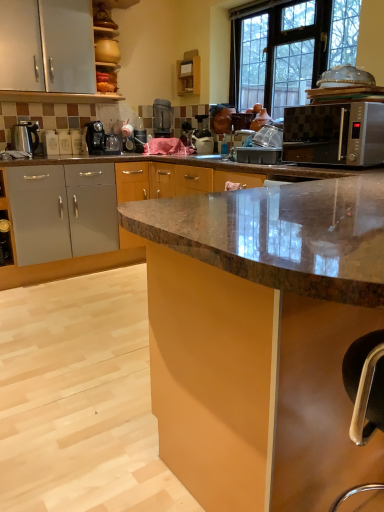
Question: Can you confirm if matte brown cabinet at center, the second cabinetry in the top-to-bottom sequence, is taller than wooden shelf at upper center, positioned as the 2th cabinetry in bottom-to-top order?

Choices:
 (A) no
 (B) yes

Answer: (B)

Question: Considering the relative sizes of matte brown cabinet at center, the 2th cabinetry from the back, and wooden shelf at upper center, the first cabinetry viewed from the back, in the image provided, is matte brown cabinet at center, the 2th cabinetry from the back, smaller than wooden shelf at upper center, the first cabinetry viewed from the back,?

Choices:
 (A) yes
 (B) no

Answer: (B)

Question: Is matte brown cabinet at center, the second cabinetry in the top-to-bottom sequence, outside of wooden shelf at upper center, the first cabinetry viewed from the back?

Choices:
 (A) no
 (B) yes

Answer: (B)

Question: Considering the relative sizes of matte brown cabinet at center, the 2th cabinetry from the back, and wooden shelf at upper center, positioned as the 2th cabinetry in bottom-to-top order, in the image provided, is matte brown cabinet at center, the 2th cabinetry from the back, wider than wooden shelf at upper center, positioned as the 2th cabinetry in bottom-to-top order,?

Choices:
 (A) yes
 (B) no

Answer: (A)

Question: Is matte brown cabinet at center, the 2th cabinetry from the back, shorter than wooden shelf at upper center, positioned as the 2th cabinetry in bottom-to-top order?

Choices:
 (A) no
 (B) yes

Answer: (A)

Question: Considering the relative positions of satin silver microwave at right and matte brown cabinet at center, the second cabinetry in the top-to-bottom sequence, in the image provided, is satin silver microwave at right to the left or to the right of matte brown cabinet at center, the second cabinetry in the top-to-bottom sequence,?

Choices:
 (A) right
 (B) left

Answer: (A)

Question: Considering the positions of satin silver microwave at right and matte brown cabinet at center, which is counted as the second cabinetry, starting from the left, in the image, is satin silver microwave at right taller or shorter than matte brown cabinet at center, which is counted as the second cabinetry, starting from the left,?

Choices:
 (A) tall
 (B) short

Answer: (B)

Question: In terms of width, does satin silver microwave at right look wider or thinner when compared to matte brown cabinet at center, which ranks as the 1th cabinetry in right-to-left order?

Choices:
 (A) thin
 (B) wide

Answer: (A)

Question: Is point (334, 141) closer or farther from the camera than point (147, 287)?

Choices:
 (A) farther
 (B) closer

Answer: (A)

Question: From the image's perspective, is matte brown cabinet at center, which is counted as the second cabinetry, starting from the left, positioned above or below satin black coffee machine at center, positioned as the first coffee machine in back-to-front order?

Choices:
 (A) below
 (B) above

Answer: (A)

Question: Is matte brown cabinet at center, which is the first cabinetry from bottom to top, bigger or smaller than satin black coffee machine at center, which ranks as the 2th coffee machine in front-to-back order?

Choices:
 (A) small
 (B) big

Answer: (B)

Question: From a real-world perspective, is matte brown cabinet at center, which ranks as the 1th cabinetry in right-to-left order, physically located above or below satin black coffee machine at center, positioned as the first coffee machine in back-to-front order?

Choices:
 (A) below
 (B) above

Answer: (A)

Question: Looking at their shapes, would you say matte brown cabinet at center, the second cabinetry in the top-to-bottom sequence, is wider or thinner than satin black coffee machine at center, positioned as the first coffee machine in back-to-front order?

Choices:
 (A) wide
 (B) thin

Answer: (A)

Question: In the image, is transparent glass window at upper center on the left side or the right side of matte brown cabinet at center, which is counted as the second cabinetry, starting from the left?

Choices:
 (A) left
 (B) right

Answer: (B)

Question: From a real-world perspective, is transparent glass window at upper center physically located above or below matte brown cabinet at center, the second cabinetry in the top-to-bottom sequence?

Choices:
 (A) below
 (B) above

Answer: (B)